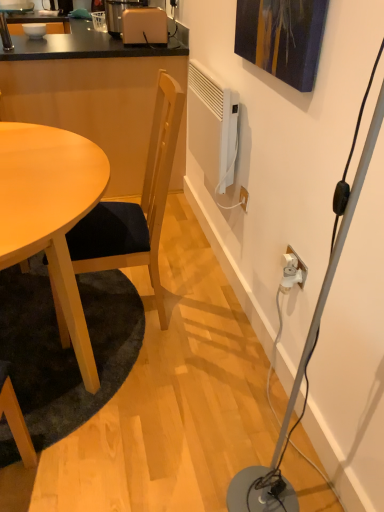
Where is `free space above light brown wooden table at lower left (from a real-world perspective)`? free space above light brown wooden table at lower left (from a real-world perspective) is located at coordinates (70, 356).